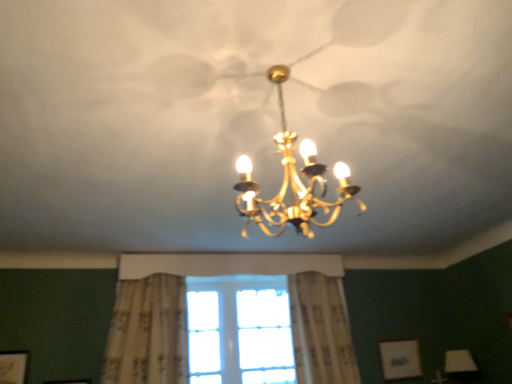
Question: Visually, is matte white picture frame at lower left, the first picture frame from the front, positioned to the left or to the right of floral-patterned fabric curtain at center, which ranks as the first curtain in left-to-right order?

Choices:
 (A) right
 (B) left

Answer: (B)

Question: Is matte white picture frame at lower left, placed as the first picture frame when sorted from left to right, situated inside floral-patterned fabric curtain at center, which is the second curtain from right to left, or outside?

Choices:
 (A) inside
 (B) outside

Answer: (B)

Question: Based on their relative distances, which object is nearer to the floral-patterned fabric curtain at center, which is the second curtain from right to left?

Choices:
 (A) white textured curtain at center, the 1th curtain viewed from the right
 (B) matte white picture frame at lower left, the first picture frame from the front
 (C) gold metallic chandelier at center
 (D) clear glass window at center
 (E) matte white picture frame at lower right, which is counted as the 1th picture frame, starting from the right

Answer: (D)

Question: Which object is the farthest from the matte white picture frame at lower right, which appears as the 2th picture frame when viewed from the front?

Choices:
 (A) white textured curtain at center, the 1th curtain viewed from the right
 (B) gold metallic chandelier at center
 (C) matte white picture frame at lower left, the second picture frame positioned from the back
 (D) clear glass window at center
 (E) floral-patterned fabric curtain at center, which ranks as the first curtain in left-to-right order

Answer: (C)